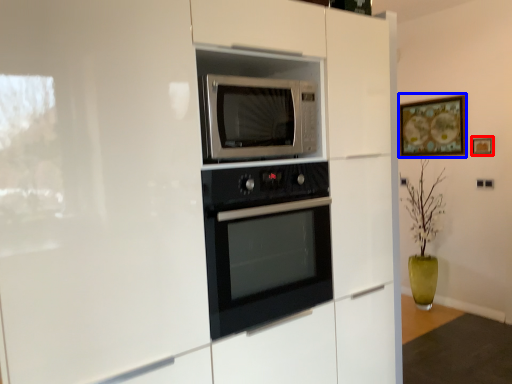
Question: Which object is closer to the camera taking this photo, picture frame (highlighted by a red box) or picture frame (highlighted by a blue box)?

Choices:
 (A) picture frame
 (B) picture frame

Answer: (A)